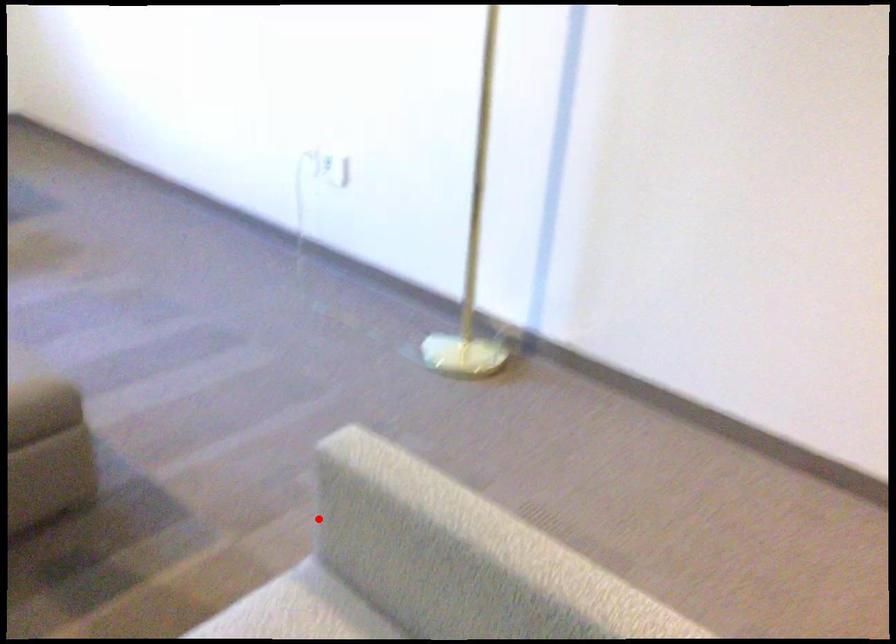
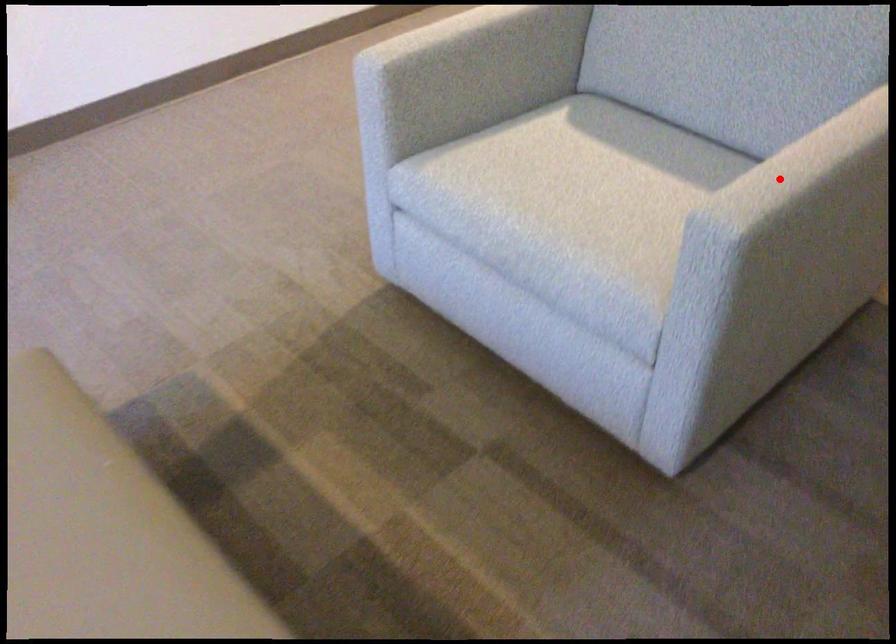
I am providing you with two images of the same scene from different viewpoints. A red point is marked on the first image and another point is marked on the second image. Is the marked point in image1 the same physical position as the marked point in image2?

No